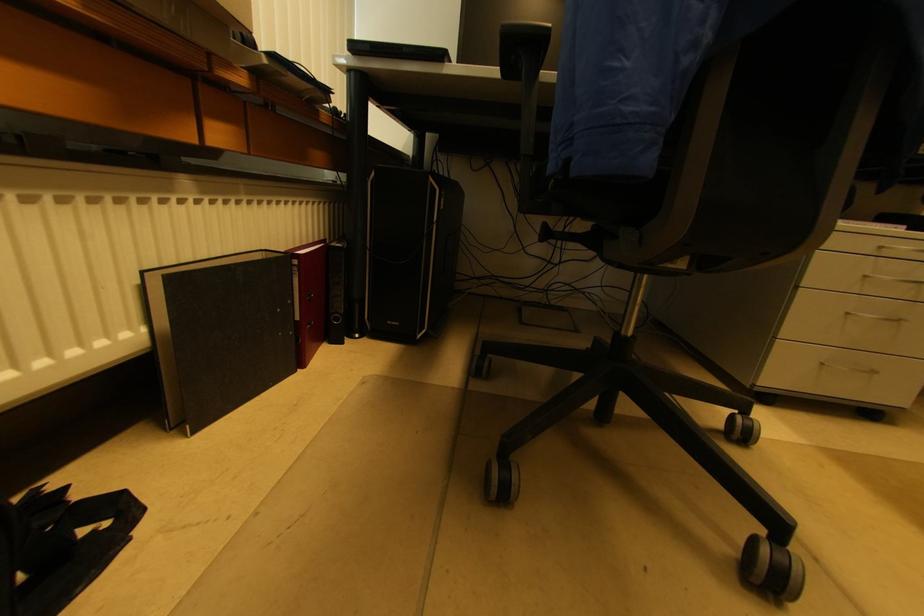
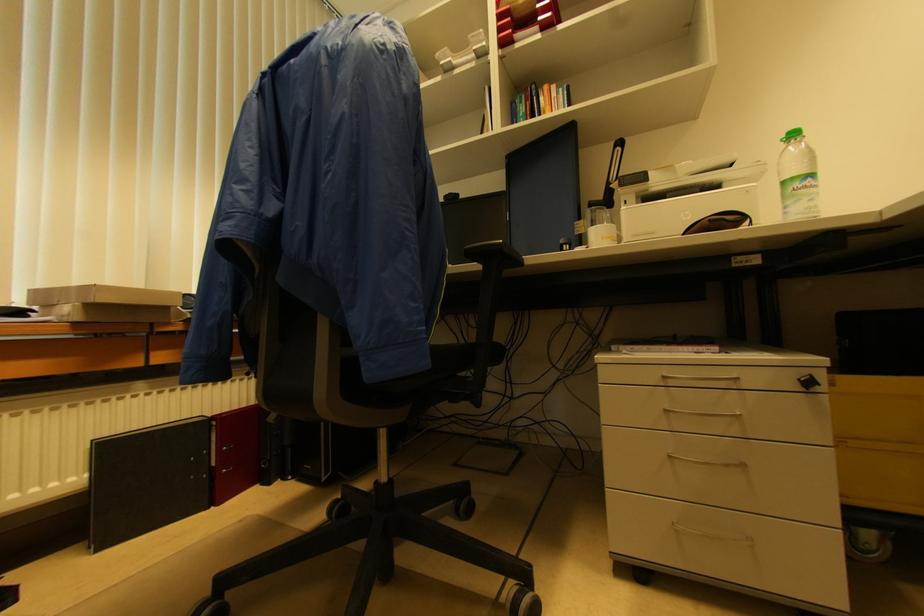
How did the camera likely rotate?

The camera rotated toward left-up.